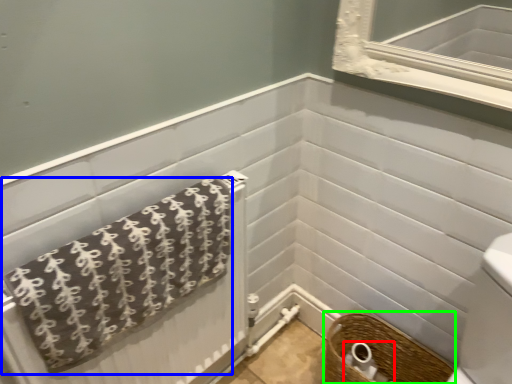
Question: Based on their relative distances, which object is farther from toilet paper (highlighted by a red box)? Choose from towel (highlighted by a blue box) and basket (highlighted by a green box).

Choices:
 (A) towel
 (B) basket

Answer: (A)